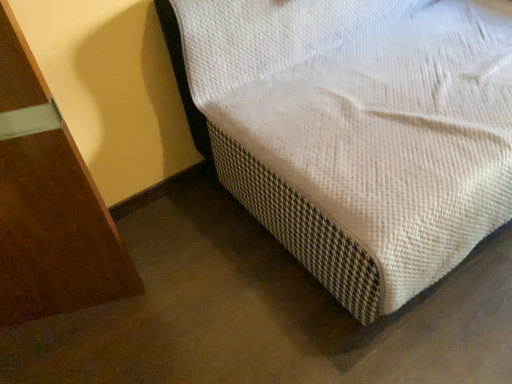
At what (x,y) coordinates should I click in order to perform the action: click on white woven mattress at lower right. Please return your answer as a coordinate pair (x, y). Looking at the image, I should click on (359, 131).

What do you see at coordinates (359, 131) in the screenshot? The width and height of the screenshot is (512, 384). I see `white woven mattress at lower right` at bounding box center [359, 131].

In order to click on white woven mattress at lower right in this screenshot , I will do `click(359, 131)`.